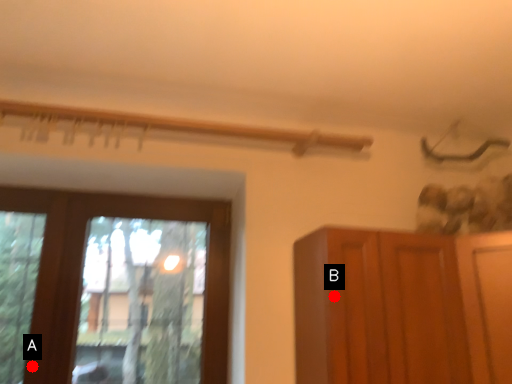
Question: Two points are circled on the image, labeled by A and B beside each circle. Which of the following is the farthest from the observer?

Choices:
 (A) A is further
 (B) B is further

Answer: (A)